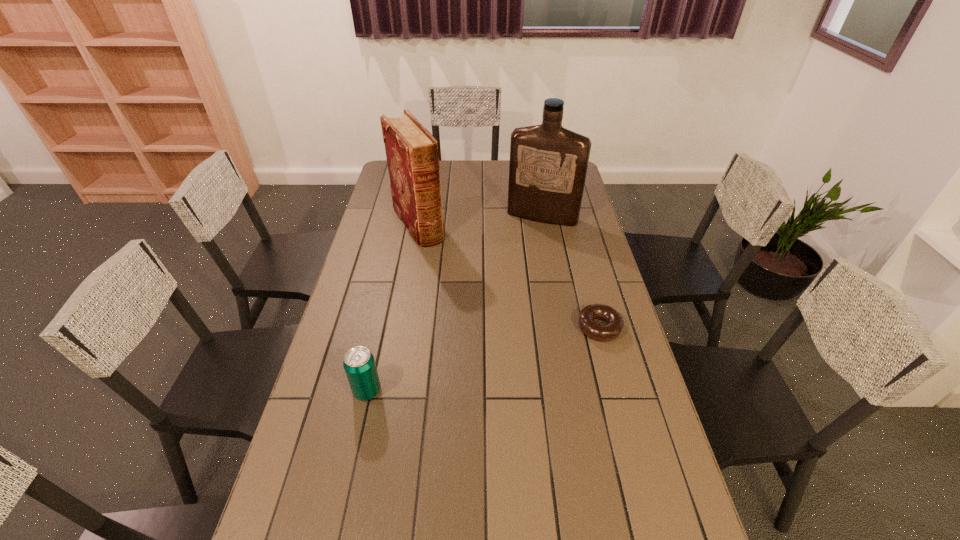
The image size is (960, 540). What are the coordinates of `the second shortest object` in the screenshot? It's located at (359, 364).

Identify the location of beer can. The width and height of the screenshot is (960, 540). (359, 364).

The height and width of the screenshot is (540, 960). I want to click on the third farthest object, so click(615, 323).

This screenshot has height=540, width=960. In order to click on doughnut in this screenshot , I will do `click(615, 323)`.

Where is `liquor`? liquor is located at coordinates (548, 164).

This screenshot has height=540, width=960. What are the coordinates of `the second tallest object` in the screenshot? It's located at pyautogui.click(x=412, y=154).

This screenshot has width=960, height=540. I want to click on vacant space located on the back of the beer can, so point(389,291).

Where is `vacant space located 0.240m on the back of the doughnut`? The image size is (960, 540). vacant space located 0.240m on the back of the doughnut is located at coordinates (583, 264).

This screenshot has width=960, height=540. Find the location of `free space located on the label side of the liquor`. free space located on the label side of the liquor is located at coordinates (525, 244).

This screenshot has height=540, width=960. I want to click on vacant space located on the label side of the liquor, so click(530, 234).